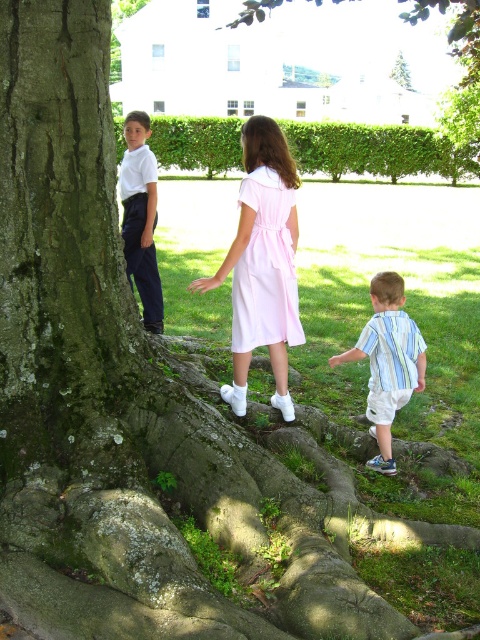
Is point (288, 337) positioned after point (470, 3)?

No, (288, 337) is in front of (470, 3).

Which is behind, point (298, 307) or point (456, 26)?

Positioned behind is point (456, 26).

The width and height of the screenshot is (480, 640). What do you see at coordinates (265, 268) in the screenshot?
I see `pink satin dress at center` at bounding box center [265, 268].

Find the location of `pink satin dress at center`. pink satin dress at center is located at coordinates (265, 268).

Who is more distant from viewer, (259, 253) or (135, 129)?

Positioned behind is point (135, 129).

Who is more forward, (x=286, y=266) or (x=134, y=275)?

Point (x=286, y=266) is more forward.

Where is `pink satin dress at center`? The image size is (480, 640). pink satin dress at center is located at coordinates [x=265, y=268].

Is pink cotton dress at center to the right of green mossy tree trunk at upper center from the viewer's perspective?

No, pink cotton dress at center is not to the right of green mossy tree trunk at upper center.

Which is above, pink cotton dress at center or green mossy tree trunk at upper center?

green mossy tree trunk at upper center is above.

Describe the element at coordinates (263, 262) in the screenshot. I see `pink cotton dress at center` at that location.

You are a GUI agent. You are given a task and a screenshot of the screen. Output one action in this format:
    pyautogui.click(x=<x>, y=<y>)
    Task: Click on the pink cotton dress at center
    
    Given the screenshot: What is the action you would take?
    pyautogui.click(x=263, y=262)